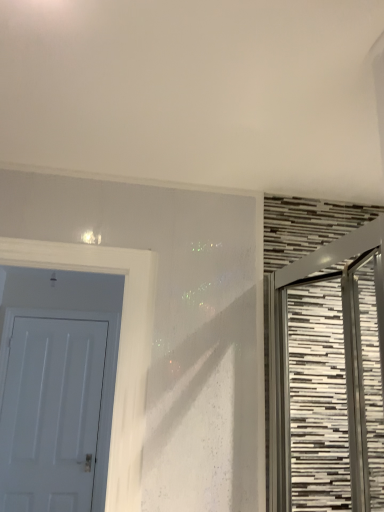
At what (x,y) coordinates should I click in order to perform the action: click on white matte door at left, acting as the 2th door starting from the front. Please return your answer as a coordinate pair (x, y). Looking at the image, I should click on (57, 388).

What is the approximate height of white matte door at left, which appears as the 1th door when viewed from the left?

The height of white matte door at left, which appears as the 1th door when viewed from the left, is 4.57 feet.

Image resolution: width=384 pixels, height=512 pixels. Describe the element at coordinates (57, 388) in the screenshot. I see `white matte door at left, the first door positioned from the back` at that location.

Describe the element at coordinates (342, 358) in the screenshot. I see `metallic textured door at right, the 2th door positioned from the left` at that location.

Locate an element on the screen. metallic textured door at right, which appears as the 2th door when viewed from the back is located at coordinates (342, 358).

How much space does metallic textured door at right, which appears as the 2th door when viewed from the back, occupy vertically?

The height of metallic textured door at right, which appears as the 2th door when viewed from the back, is 71.31 centimeters.

The width and height of the screenshot is (384, 512). In order to click on white matte door at left, the first door positioned from the back in this screenshot , I will do `click(57, 388)`.

Does white matte door at left, which ranks as the 2th door in right-to-left order, appear on the left side of metallic textured door at right, which appears as the 2th door when viewed from the back?

Indeed, white matte door at left, which ranks as the 2th door in right-to-left order, is positioned on the left side of metallic textured door at right, which appears as the 2th door when viewed from the back.

Which object is closer to the camera, white matte door at left, which ranks as the 2th door in right-to-left order, or metallic textured door at right, which appears as the 2th door when viewed from the back?

metallic textured door at right, which appears as the 2th door when viewed from the back.

Does point (111, 353) come in front of point (347, 290)?

No, it is not.

From the image's perspective, is white matte door at left, which ranks as the 2th door in right-to-left order, on top of metallic textured door at right, the 2th door positioned from the left?

No, from the image's perspective, white matte door at left, which ranks as the 2th door in right-to-left order, is not above metallic textured door at right, the 2th door positioned from the left.

From a real-world perspective, is white matte door at left, which appears as the 1th door when viewed from the left, located beneath metallic textured door at right, the 2th door positioned from the left?

Indeed, from a real-world perspective, white matte door at left, which appears as the 1th door when viewed from the left, is positioned beneath metallic textured door at right, the 2th door positioned from the left.

Considering the sizes of white matte door at left, the first door positioned from the back, and metallic textured door at right, the 2th door positioned from the left, in the image, is white matte door at left, the first door positioned from the back, wider or thinner than metallic textured door at right, the 2th door positioned from the left,?

Considering their sizes, white matte door at left, the first door positioned from the back, looks slimmer than metallic textured door at right, the 2th door positioned from the left.

Can you confirm if white matte door at left, acting as the 2th door starting from the front, is shorter than metallic textured door at right, the 1th door in the right-to-left sequence?

No, white matte door at left, acting as the 2th door starting from the front, is not shorter than metallic textured door at right, the 1th door in the right-to-left sequence.

Who is bigger, white matte door at left, the first door positioned from the back, or metallic textured door at right, the 1th door in the right-to-left sequence?

With larger size is metallic textured door at right, the 1th door in the right-to-left sequence.

Which is correct: white matte door at left, which ranks as the 2th door in right-to-left order, is inside metallic textured door at right, which appears as the 2th door when viewed from the back, or outside of it?

white matte door at left, which ranks as the 2th door in right-to-left order, lies outside metallic textured door at right, which appears as the 2th door when viewed from the back.

Are white matte door at left, acting as the 2th door starting from the front, and metallic textured door at right, which appears as the 2th door when viewed from the back, far apart?

white matte door at left, acting as the 2th door starting from the front, is positioned a significant distance from metallic textured door at right, which appears as the 2th door when viewed from the back.

Is white matte door at left, acting as the 2th door starting from the front, oriented away from metallic textured door at right, the 1th door in the right-to-left sequence?

No, white matte door at left, acting as the 2th door starting from the front,'s orientation is not away from metallic textured door at right, the 1th door in the right-to-left sequence.

How many degrees apart are the facing directions of white matte door at left, which appears as the 1th door when viewed from the left, and metallic textured door at right, the 1th door in the right-to-left sequence?

The angular difference between white matte door at left, which appears as the 1th door when viewed from the left, and metallic textured door at right, the 1th door in the right-to-left sequence, is 89.3 degrees.

Locate an element on the screen. This screenshot has height=512, width=384. door below the metallic textured door at right, which appears as the 2th door when viewed from the back (from a real-world perspective) is located at coordinates (57, 388).

Is metallic textured door at right, the first door from the front, at the right side of white matte door at left, which appears as the 1th door when viewed from the left?

Correct, you'll find metallic textured door at right, the first door from the front, to the right of white matte door at left, which appears as the 1th door when viewed from the left.

Based on the photo, does metallic textured door at right, the 1th door in the right-to-left sequence, lie in front of white matte door at left, which appears as the 1th door when viewed from the left?

That is True.

Does point (280, 503) appear closer or farther from the camera than point (50, 399)?

Point (280, 503) is positioned closer to the camera compared to point (50, 399).

From the image's perspective, is metallic textured door at right, which appears as the 2th door when viewed from the back, under white matte door at left, which appears as the 1th door when viewed from the left?

No, from the image's perspective, metallic textured door at right, which appears as the 2th door when viewed from the back, is not below white matte door at left, which appears as the 1th door when viewed from the left.

From a real-world perspective, which object stands above the other?

metallic textured door at right, the first door from the front, from a real-world perspective.

Is metallic textured door at right, the 1th door in the right-to-left sequence, thinner than white matte door at left, acting as the 2th door starting from the front?

Incorrect, the width of metallic textured door at right, the 1th door in the right-to-left sequence, is not less than that of white matte door at left, acting as the 2th door starting from the front.

Which of these two, metallic textured door at right, the 1th door in the right-to-left sequence, or white matte door at left, which appears as the 1th door when viewed from the left, stands taller?

white matte door at left, which appears as the 1th door when viewed from the left, is taller.

Considering the relative sizes of metallic textured door at right, the first door from the front, and white matte door at left, which appears as the 1th door when viewed from the left, in the image provided, is metallic textured door at right, the first door from the front, smaller than white matte door at left, which appears as the 1th door when viewed from the left,?

Actually, metallic textured door at right, the first door from the front, might be larger than white matte door at left, which appears as the 1th door when viewed from the left.

Is metallic textured door at right, the first door from the front, not inside white matte door at left, the first door positioned from the back?

Yes.

Is metallic textured door at right, which appears as the 2th door when viewed from the back, positioned far away from white matte door at left, the first door positioned from the back?

Yes, metallic textured door at right, which appears as the 2th door when viewed from the back, and white matte door at left, the first door positioned from the back, are quite far apart.

From the picture: Is metallic textured door at right, the 2th door positioned from the left, aimed at white matte door at left, the first door positioned from the back?

No, metallic textured door at right, the 2th door positioned from the left, is not facing towards white matte door at left, the first door positioned from the back.

Where is `door on the left of the metallic textured door at right, the 1th door in the right-to-left sequence`? The height and width of the screenshot is (512, 384). door on the left of the metallic textured door at right, the 1th door in the right-to-left sequence is located at coordinates (57, 388).

Locate an element on the screen. The width and height of the screenshot is (384, 512). door above the white matte door at left, which appears as the 1th door when viewed from the left (from the image's perspective) is located at coordinates (342, 358).

The width and height of the screenshot is (384, 512). I want to click on door that appears behind the metallic textured door at right, the 1th door in the right-to-left sequence, so click(57, 388).